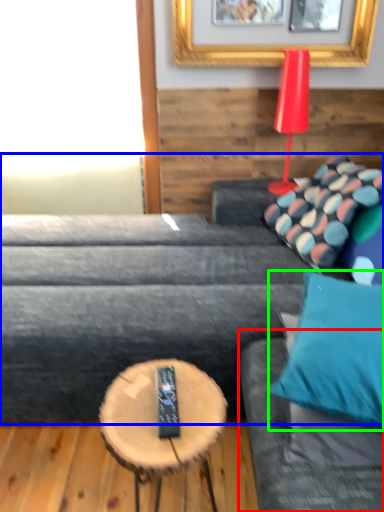
Question: Which object is the farthest from couch (highlighted by a red box)? Choose among these: studio couch (highlighted by a blue box) or pillow (highlighted by a green box).

Choices:
 (A) studio couch
 (B) pillow

Answer: (A)